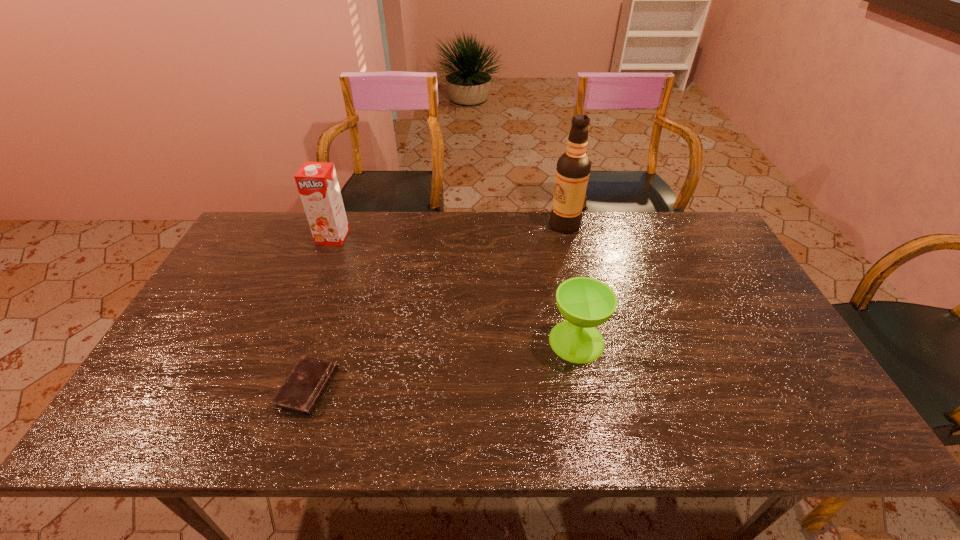
Find the location of a particular element. This screenshot has height=540, width=960. alcohol is located at coordinates (573, 168).

Find the location of a particular element. Image resolution: width=960 pixels, height=540 pixels. the second tallest object is located at coordinates (317, 183).

The width and height of the screenshot is (960, 540). Identify the location of the third tallest object. (585, 303).

Where is `the shortest object`? The image size is (960, 540). the shortest object is located at coordinates (300, 393).

The image size is (960, 540). What are the coordinates of `vacant space located 0.080m on the label of the alcohol` in the screenshot? It's located at (526, 225).

At what (x,y) coordinates should I click in order to perform the action: click on free space located 0.130m on the label of the alcohol. Please return your answer as a coordinate pair (x, y). The height and width of the screenshot is (540, 960). Looking at the image, I should click on (511, 225).

Where is `vacant space located 0.280m on the label of the alcohol`? Image resolution: width=960 pixels, height=540 pixels. vacant space located 0.280m on the label of the alcohol is located at coordinates (468, 225).

Where is `free point located on the right of the third shortest object`? The height and width of the screenshot is (540, 960). free point located on the right of the third shortest object is located at coordinates (374, 237).

Locate an element on the screen. The width and height of the screenshot is (960, 540). vacant region located on the left of the third tallest object is located at coordinates (472, 341).

Where is `vacant region located on the back of the shortest object`? vacant region located on the back of the shortest object is located at coordinates (323, 342).